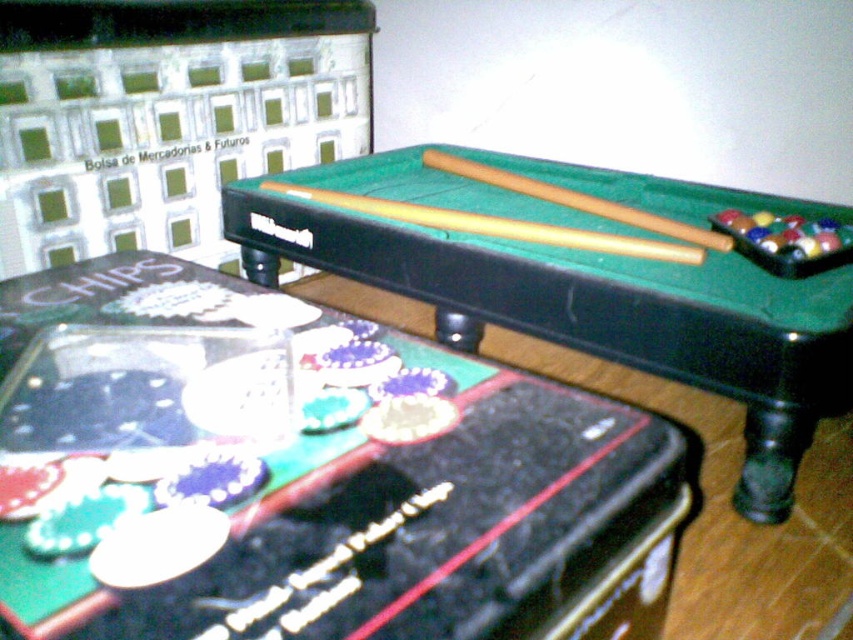
You are standing at the origin point of the coordinate system. Where is the green felt pool table at upper center located?

The green felt pool table at upper center is located at coordinates point (300, 472).

You are standing in front of the pool table and want to place a new set of pool balls on the green felt pool table at center. However, there is already a set of balls on the green felt pool table at upper center. Which table should you move the existing balls from to make space?

You should move the existing pool balls from the green felt pool table at upper center to the green felt pool table at center because the green felt pool table at upper center is closer to the viewer and the one at center is further back, so moving them there would free up space on the closer table.

You are setting up a miniature pool table and have two green felt pool tables. You need to place them so they are exactly 18.22 inches apart. According to the scene description, are the green felt pool table at upper center and the green felt pool table at center already positioned correctly?

Yes, the green felt pool table at upper center and the green felt pool table at center are already positioned correctly as they are 18.22 inches apart from each other according to the description.